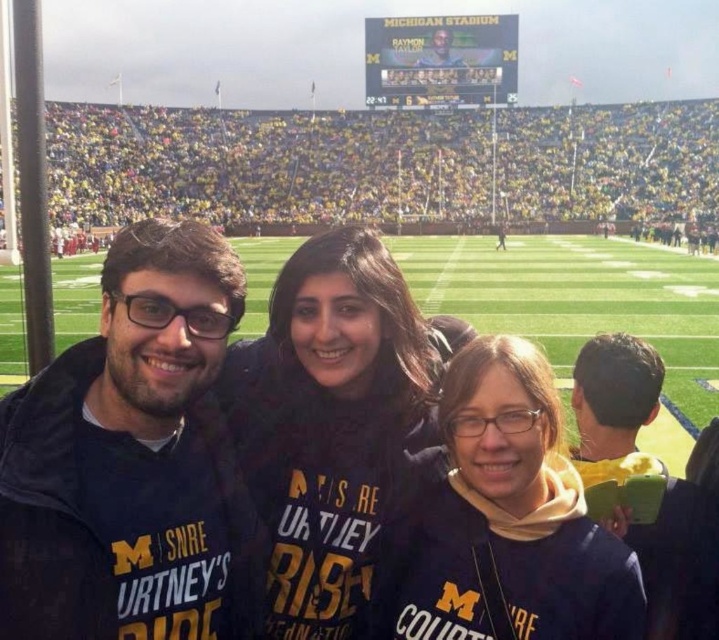
You are taking a photo with two friends wearing the dark blue fabric at center and dark blue jacket at right. Which friend is standing more to your left?

The dark blue fabric at center is positioned on the left side of dark blue jacket at right, so the friend wearing the dark blue fabric at center is standing more to your left.

What is the exact location of the dark blue fabric at center in the image?

The dark blue fabric at center is located at point (132, 460).